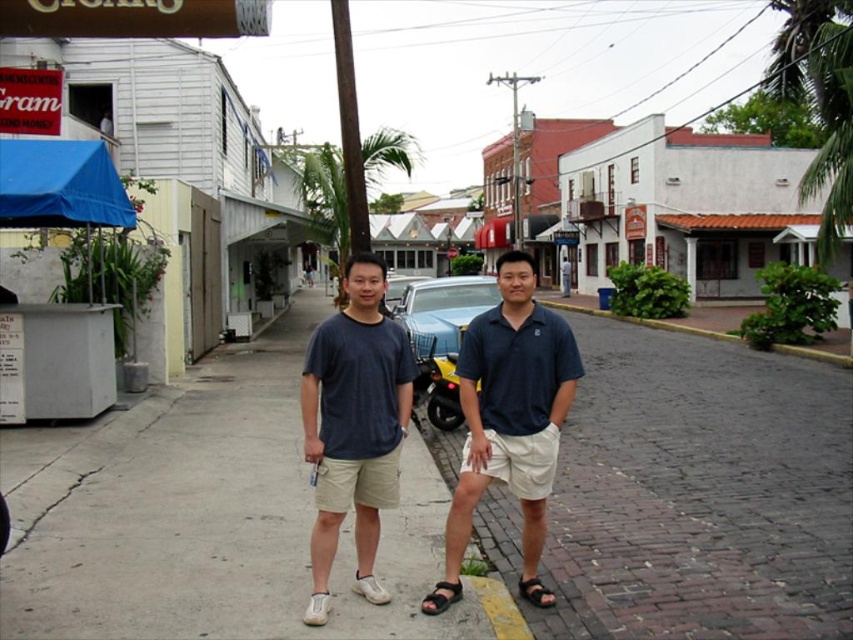
Locate an element on the screen. gray concrete sidewalk at center is located at coordinates (212, 516).

What do you see at coordinates (212, 516) in the screenshot? I see `gray concrete sidewalk at center` at bounding box center [212, 516].

Does point (180, 385) come closer to viewer compared to point (426, 324)?

No, it is not.

The image size is (853, 640). What are the coordinates of `gray concrete sidewalk at center` in the screenshot? It's located at (212, 516).

Which is in front, point (451, 589) or point (363, 570)?

Positioned in front is point (451, 589).

Can you confirm if dark blue polo shirt at center is positioned above matte blue t-shirt at center?

Indeed, dark blue polo shirt at center is positioned over matte blue t-shirt at center.

Locate an element on the screen. Image resolution: width=853 pixels, height=640 pixels. dark blue polo shirt at center is located at coordinates (x=509, y=420).

Does gray concrete sidewalk at center appear on the left side of matte blue t-shirt at center?

Correct, you'll find gray concrete sidewalk at center to the left of matte blue t-shirt at center.

Does point (134, 419) come closer to viewer compared to point (329, 481)?

That is False.

Locate an element on the screen. gray concrete sidewalk at center is located at coordinates (212, 516).

Identify the location of gray concrete sidewalk at center. (212, 516).